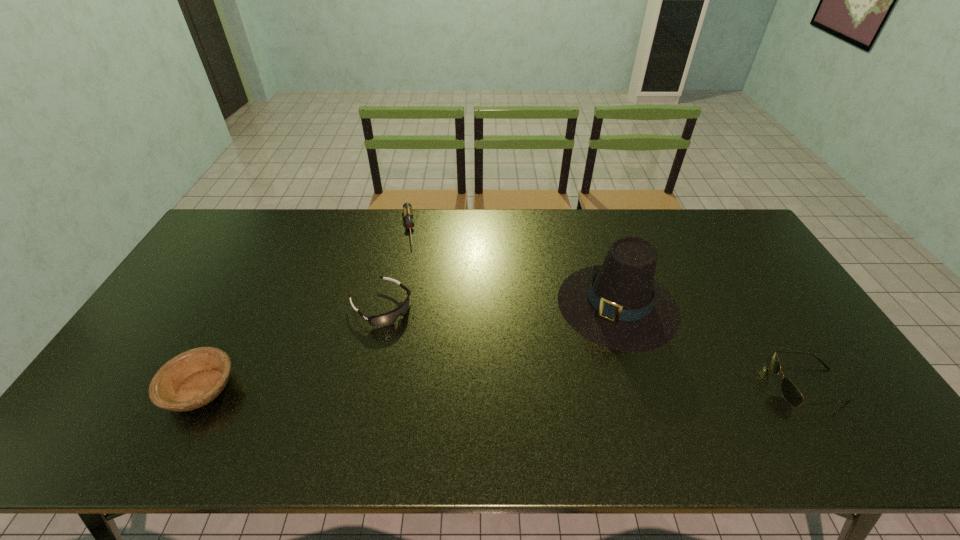
You are a GUI agent. You are given a task and a screenshot of the screen. Output one action in this format:
    pyautogui.click(x=<x>, y=<y>)
    Task: Click on the leftmost object
    This screenshot has width=960, height=540.
    Given the screenshot: What is the action you would take?
    pyautogui.click(x=192, y=379)

You are a GUI agent. You are given a task and a screenshot of the screen. Output one action in this format:
    pyautogui.click(x=<x>, y=<y>)
    Task: Click on the sunglasses
    The height and width of the screenshot is (540, 960).
    Given the screenshot: What is the action you would take?
    pyautogui.click(x=791, y=394)

At what (x,y) coordinates should I click in order to perform the action: click on goggles. Please return your answer as a coordinate pair (x, y). The height and width of the screenshot is (540, 960). Looking at the image, I should click on (388, 318).

Where is `the shortest object`? the shortest object is located at coordinates (407, 207).

At what (x,y) coordinates should I click in order to perform the action: click on screwdriver. Please return your answer as a coordinate pair (x, y). Image resolution: width=960 pixels, height=540 pixels. Looking at the image, I should click on (407, 207).

Locate an element on the screen. The height and width of the screenshot is (540, 960). the tallest object is located at coordinates (618, 305).

This screenshot has height=540, width=960. What are the coordinates of `the second object from right to left` in the screenshot? It's located at (618, 305).

Locate an element on the screen. The width and height of the screenshot is (960, 540). vacant space located 0.250m on the right of the bowl is located at coordinates (336, 389).

Locate an element on the screen. free space located 0.270m on the front-facing side of the sunglasses is located at coordinates (666, 385).

This screenshot has height=540, width=960. Identify the location of vacant space located 0.090m on the front-facing side of the sunglasses. (737, 385).